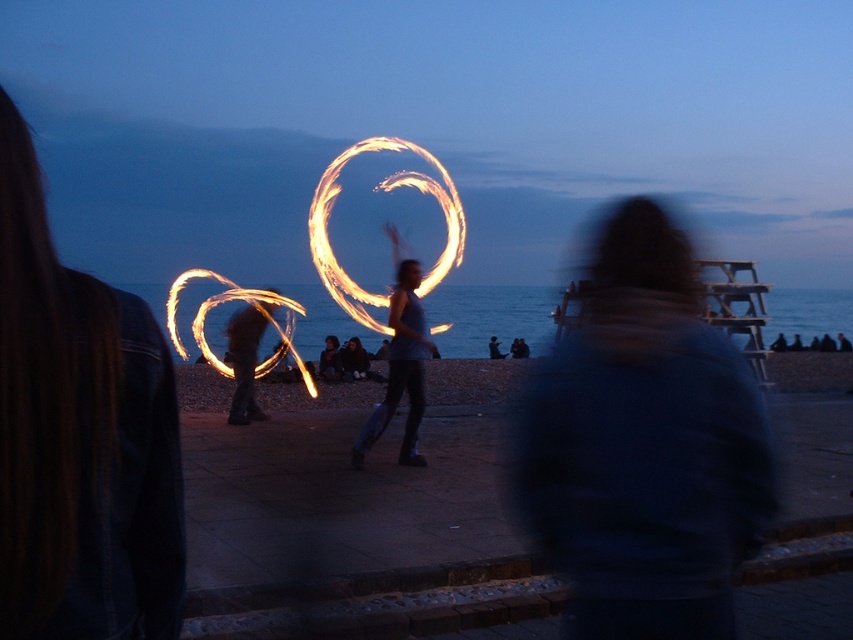
Question: Considering the relative positions of dark blue fabric at center and silvery metallic fire hoop at center in the image provided, where is dark blue fabric at center located with respect to silvery metallic fire hoop at center?

Choices:
 (A) above
 (B) below

Answer: (A)

Question: Considering the relative positions of fluorescent orange fire at center and silvery metallic fire hoop at center in the image provided, where is fluorescent orange fire at center located with respect to silvery metallic fire hoop at center?

Choices:
 (A) left
 (B) right

Answer: (B)

Question: Which of the following is the farthest from the observer?

Choices:
 (A) (172, 634)
 (B) (329, 292)
 (C) (624, 426)

Answer: (B)

Question: Which of the following is the farthest from the observer?

Choices:
 (A) silvery metallic fire hoop at center
 (B) fluorescent orange fire at center

Answer: (A)

Question: Can you confirm if dark blue fabric at center is bigger than silvery metallic fire hoop at center?

Choices:
 (A) no
 (B) yes

Answer: (A)

Question: Which of the following is the farthest from the observer?

Choices:
 (A) silvery metallic fire hoop at center
 (B) denim jacket at left
 (C) fluorescent orange fire at center
 (D) dark blue fabric at center

Answer: (A)